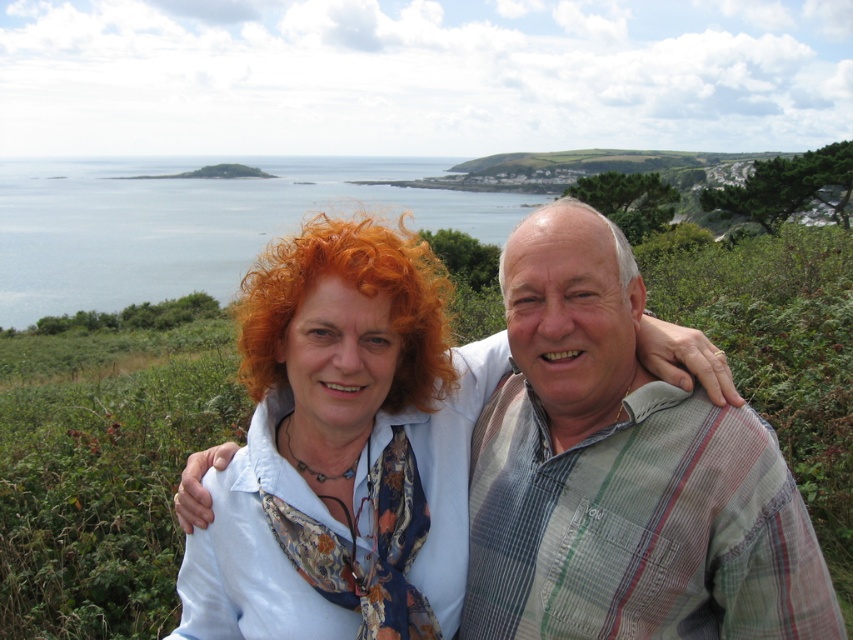
Does blue water at upper left have a lesser width compared to curly orange hair at center?

In fact, blue water at upper left might be wider than curly orange hair at center.

Which is behind, point (314, 157) or point (426, 332)?

Point (314, 157)

Locate an element on the screen. Image resolution: width=853 pixels, height=640 pixels. blue water at upper left is located at coordinates (193, 221).

Find the location of a particular element. This screenshot has width=853, height=640. blue water at upper left is located at coordinates (193, 221).

Which is above, striped cotton shirt at center or blue water at upper left?

blue water at upper left is higher up.

Can you confirm if striped cotton shirt at center is shorter than blue water at upper left?

Yes.

Locate an element on the screen. This screenshot has width=853, height=640. striped cotton shirt at center is located at coordinates point(622,474).

Is point (10, 182) in front of point (556, 198)?

No, (10, 182) is behind (556, 198).

Does point (413, 227) come in front of point (627, 244)?

No, (413, 227) is further to viewer.

Where is `blue water at upper left`? The image size is (853, 640). blue water at upper left is located at coordinates (193, 221).